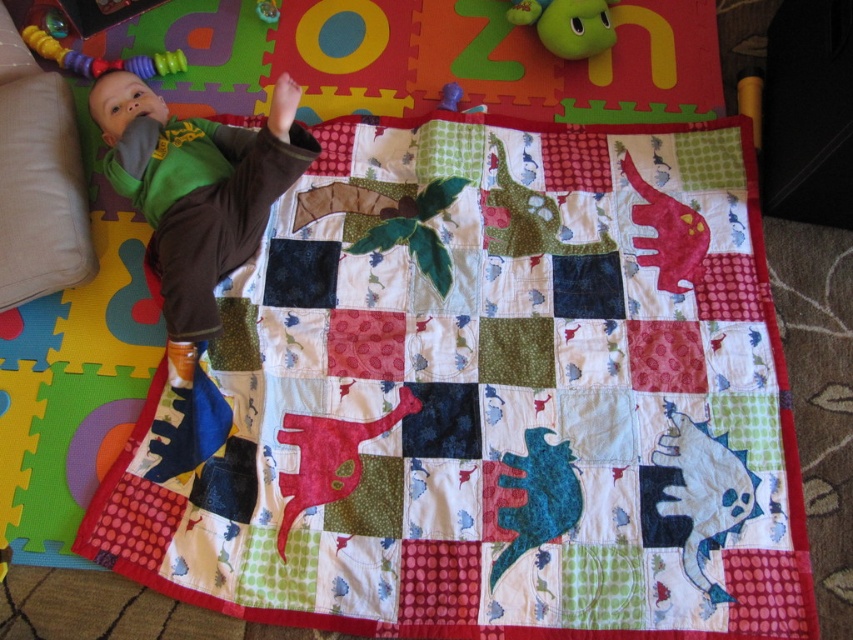
Is beige fabric pillow at left smaller than matte red dinosaur at center?

No, beige fabric pillow at left is not smaller than matte red dinosaur at center.

Between beige fabric pillow at left and matte red dinosaur at center, which one appears on the right side from the viewer's perspective?

From the viewer's perspective, matte red dinosaur at center appears more on the right side.

What are the coordinates of `beige fabric pillow at left` in the screenshot? It's located at (x=39, y=193).

Who is shorter, matte red dinosaur at center or rubberized plastic teething ring at upper left?

rubberized plastic teething ring at upper left

Can you confirm if matte red dinosaur at center is positioned above rubberized plastic teething ring at upper left?

Incorrect, matte red dinosaur at center is not positioned above rubberized plastic teething ring at upper left.

Between point (281, 545) and point (177, 70), which one is positioned behind?

The point (177, 70) is behind.

In order to click on matte red dinosaur at center in this screenshot , I will do `click(328, 458)`.

Does multicolored quilt with dinosaur patches at center appear on the right side of beige fabric pillow at left?

Indeed, multicolored quilt with dinosaur patches at center is positioned on the right side of beige fabric pillow at left.

Which is in front, point (473, 627) or point (56, 84)?

Positioned in front is point (473, 627).

Locate an element on the screen. The height and width of the screenshot is (640, 853). multicolored quilt with dinosaur patches at center is located at coordinates (490, 397).